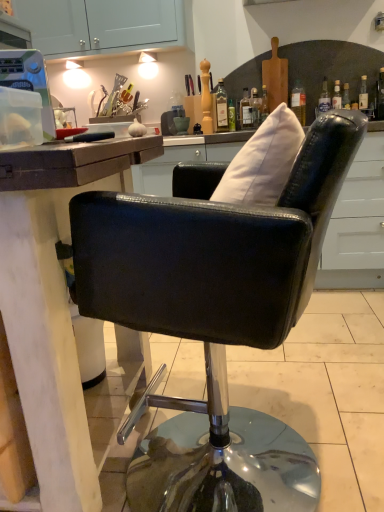
Question: From the image's perspective, is transparent plastic container at upper left below green glass bottle at upper center, the second bottle when ordered from right to left?

Choices:
 (A) no
 (B) yes

Answer: (B)

Question: Is green glass bottle at upper center, which ranks as the second bottle in left-to-right order, surrounded by transparent plastic container at upper left?

Choices:
 (A) no
 (B) yes

Answer: (A)

Question: Considering the relative sizes of transparent plastic container at upper left and green glass bottle at upper center, the second bottle when ordered from right to left, in the image provided, is transparent plastic container at upper left smaller than green glass bottle at upper center, the second bottle when ordered from right to left,?

Choices:
 (A) no
 (B) yes

Answer: (A)

Question: Is transparent plastic container at upper left wider than green glass bottle at upper center, which ranks as the second bottle in left-to-right order?

Choices:
 (A) yes
 (B) no

Answer: (A)

Question: Is transparent plastic container at upper left at the right side of green glass bottle at upper center, the second bottle when ordered from right to left?

Choices:
 (A) yes
 (B) no

Answer: (B)

Question: Is transparent plastic container at upper left positioned behind green glass bottle at upper center, which ranks as the second bottle in left-to-right order?

Choices:
 (A) yes
 (B) no

Answer: (B)

Question: Is white fabric pillow at upper center completely or partially inside transparent plastic container at upper left?

Choices:
 (A) yes
 (B) no

Answer: (B)

Question: Does transparent plastic container at upper left have a smaller size compared to white fabric pillow at upper center?

Choices:
 (A) yes
 (B) no

Answer: (A)

Question: Considering the relative sizes of transparent plastic container at upper left and white fabric pillow at upper center in the image provided, is transparent plastic container at upper left taller than white fabric pillow at upper center?

Choices:
 (A) no
 (B) yes

Answer: (A)

Question: Is transparent plastic container at upper left far from white fabric pillow at upper center?

Choices:
 (A) no
 (B) yes

Answer: (A)

Question: Is the depth of transparent plastic container at upper left greater than that of white fabric pillow at upper center?

Choices:
 (A) no
 (B) yes

Answer: (B)

Question: Are transparent plastic container at upper left and white fabric pillow at upper center making contact?

Choices:
 (A) yes
 (B) no

Answer: (B)

Question: Is green glass bottle at upper center, which ranks as the second bottle in left-to-right order, thinner than white fabric pillow at upper center?

Choices:
 (A) no
 (B) yes

Answer: (B)